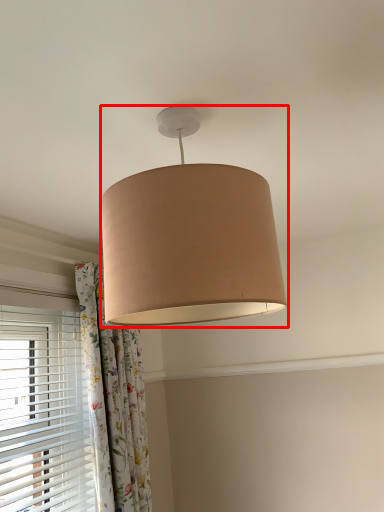
Question: From the image's perspective, where is lamp (annotated by the red box) located in relation to curtain in the image?

Choices:
 (A) above
 (B) below

Answer: (A)